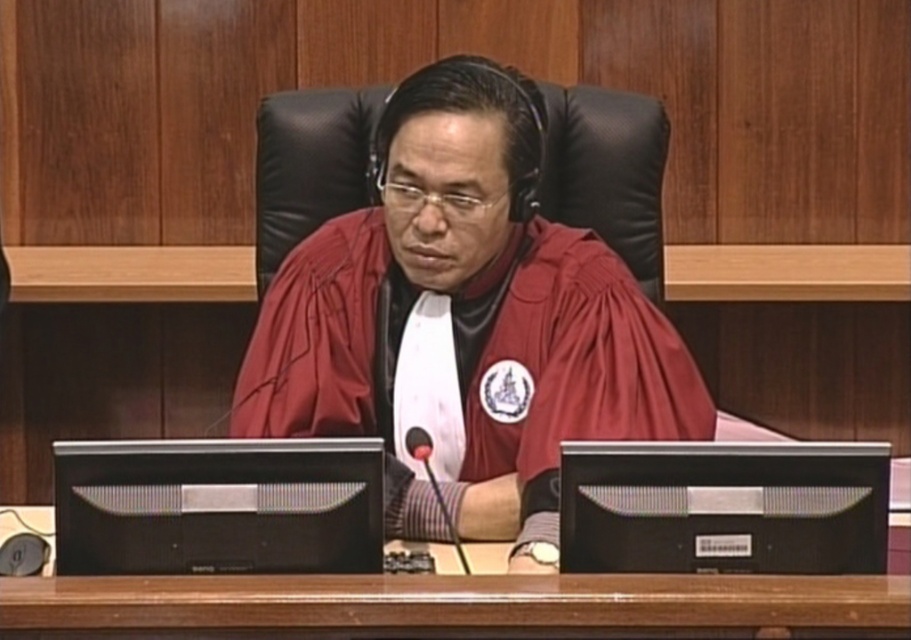
Does matte red robe at center appear on the right side of black leather chair at center?

In fact, matte red robe at center is to the left of black leather chair at center.

Which is in front, point (345, 346) or point (659, 132)?

Point (345, 346) is in front.

Find the location of a particular element. This screenshot has height=640, width=911. matte red robe at center is located at coordinates (466, 321).

Identify the location of matte red robe at center. (466, 321).

Is matte red robe at center taller than black matte monitor at center?

Indeed, matte red robe at center has a greater height compared to black matte monitor at center.

Can you confirm if matte red robe at center is thinner than black matte monitor at center?

No, matte red robe at center is not thinner than black matte monitor at center.

Where is `matte red robe at center`? This screenshot has height=640, width=911. matte red robe at center is located at coordinates (466, 321).

Who is more forward, (461, 584) or (185, 564)?

Point (461, 584)

Can you confirm if brown wood table at center is positioned to the left of black matte monitor at center?

Incorrect, brown wood table at center is not on the left side of black matte monitor at center.

Which is in front, point (827, 609) or point (177, 545)?

Point (827, 609)

Where is `brown wood table at center`? This screenshot has width=911, height=640. brown wood table at center is located at coordinates (458, 604).